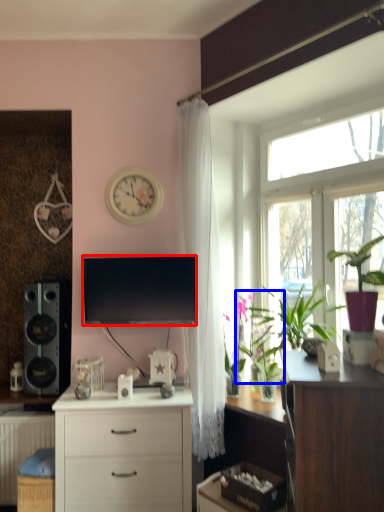
Question: Which point is further to the camera, television (highlighted by a red box) or plant (highlighted by a blue box)?

Choices:
 (A) television
 (B) plant

Answer: (A)